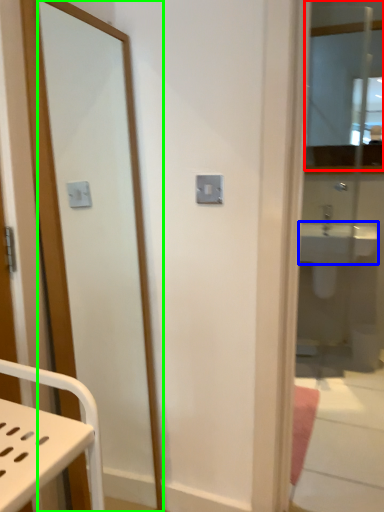
Question: Considering the real-world distances, which object is farthest from mirror (highlighted by a red box)? sink (highlighted by a blue box) or mirror (highlighted by a green box)?

Choices:
 (A) sink
 (B) mirror

Answer: (B)